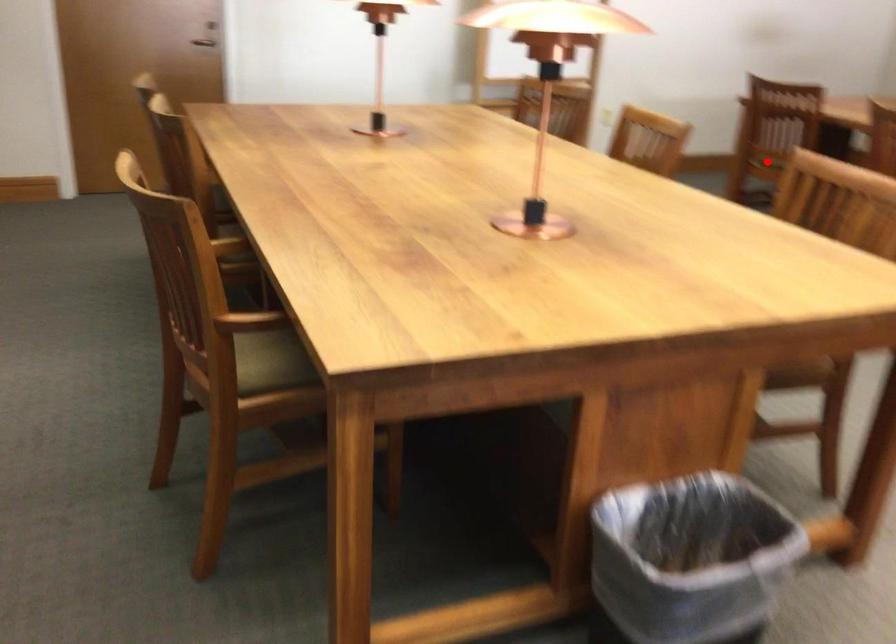
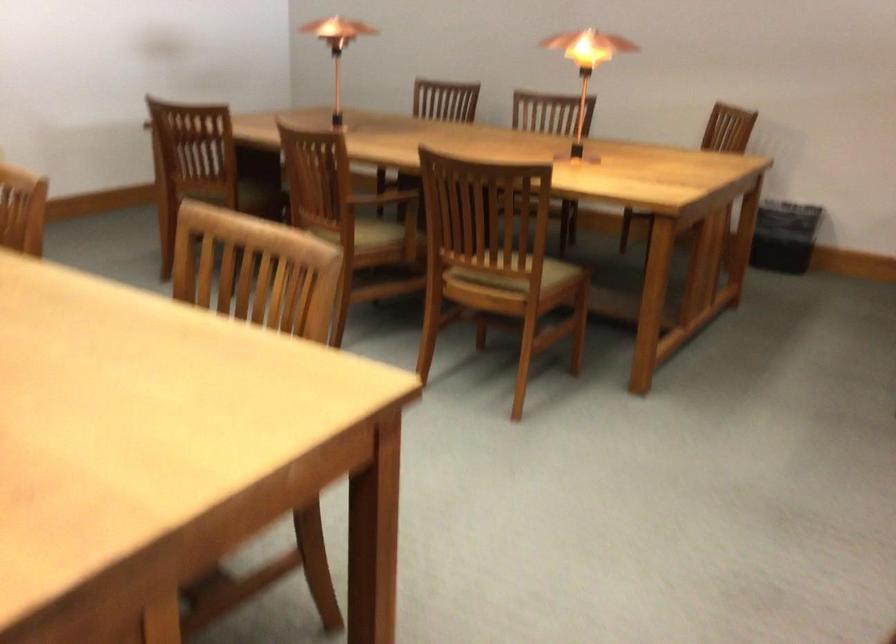
Question: I am providing you with two images of the same scene from different viewpoints. A red point is marked on the first image. At the location where the point appears in image 1, is it still visible in image 2?

Choices:
 (A) Yes
 (B) No

Answer: (B)